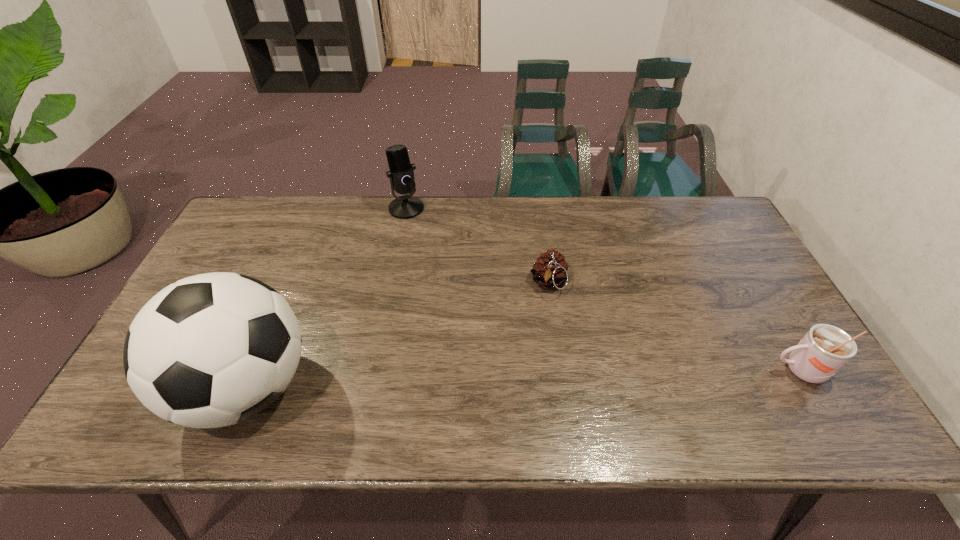
You are a GUI agent. You are given a task and a screenshot of the screen. Output one action in this format:
    pyautogui.click(x=<x>, y=<y>)
    Task: Click on the free space on the desktop that is between the soccer ball and the rightmost object and is positioned on the stand of the third object from right to left
    The image size is (960, 540).
    Given the screenshot: What is the action you would take?
    pyautogui.click(x=468, y=381)

At what (x,y) coordinates should I click in order to perform the action: click on free space on the desktop that is between the soccer ball and the cup and is positioned with a leaf charm attached to the third object from left to right. Please return your answer as a coordinate pair (x, y). This screenshot has width=960, height=540. Looking at the image, I should click on (539, 378).